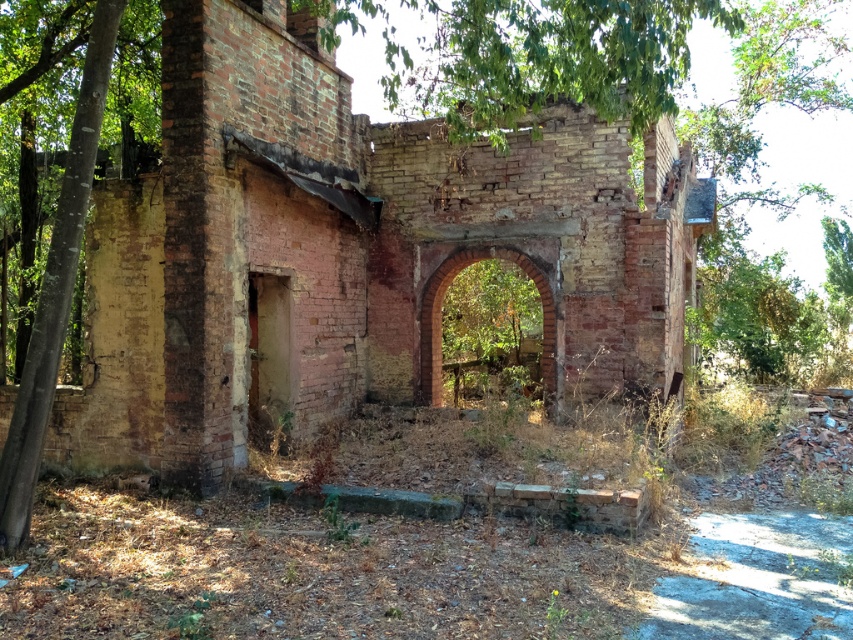
You are standing at the coordinates 0.5, 0.5 in the image. Which direction should you move to reach the rusty brick ruins at center?

The rusty brick ruins at center is located at point (351,252). Since you are at (426,320), you should move slightly to the left and down to reach it.

You are an explorer standing in front of the rusty brick ruins at center and the red brick archway at center. Which structure is positioned to the left side from your perspective?

The rusty brick ruins at center are to the left of the red brick archway at center, so the rusty brick ruins at center is positioned to the left side from your perspective.

You are an archaeologist examining the old structure. You need to determine which part of the structure is wider between the rusty brick ruins at center and the red brick archway at center. Based on the scene, which one is wider?

The red brick archway at center is wider than the rusty brick ruins at center.